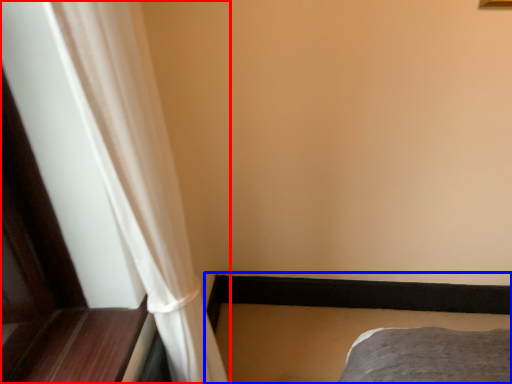
Question: Which point is further to the camera, curtain (highlighted by a red box) or bed frame (highlighted by a blue box)?

Choices:
 (A) curtain
 (B) bed frame

Answer: (B)